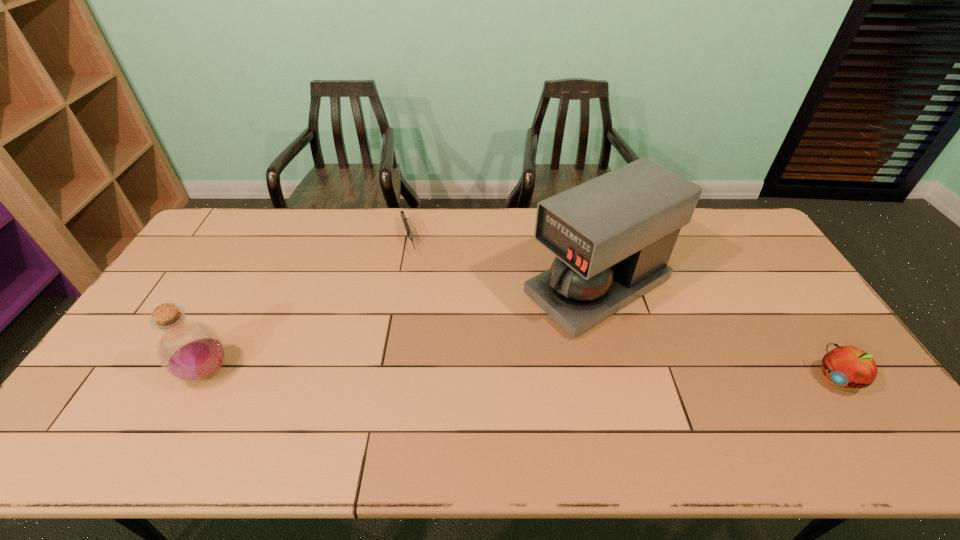
This screenshot has width=960, height=540. I want to click on object at the right edge, so click(x=845, y=366).

Locate an element on the screen. The width and height of the screenshot is (960, 540). object positioned at the near right corner is located at coordinates (845, 366).

This screenshot has width=960, height=540. In the image, there is a desktop. Find the location of `vacant region at the far edge`. vacant region at the far edge is located at coordinates (452, 227).

The image size is (960, 540). In order to click on vacant space at the near edge of the desktop in this screenshot , I will do `click(547, 395)`.

This screenshot has height=540, width=960. Find the location of `vacant space at the right edge of the desktop`. vacant space at the right edge of the desktop is located at coordinates (792, 305).

Locate an element on the screen. blank space at the far left corner of the desktop is located at coordinates (242, 221).

Find the location of a particular element. The width and height of the screenshot is (960, 540). free spot between the second object from left to right and the third object from left to right is located at coordinates (503, 264).

This screenshot has height=540, width=960. Find the location of `vacant space that is in between the third tallest object and the gun`. vacant space that is in between the third tallest object and the gun is located at coordinates (623, 309).

I want to click on vacant area that lies between the bottle and the second object from left to right, so click(308, 305).

The image size is (960, 540). What are the coordinates of `vacant area that lies between the tallest object and the apple` in the screenshot? It's located at (717, 334).